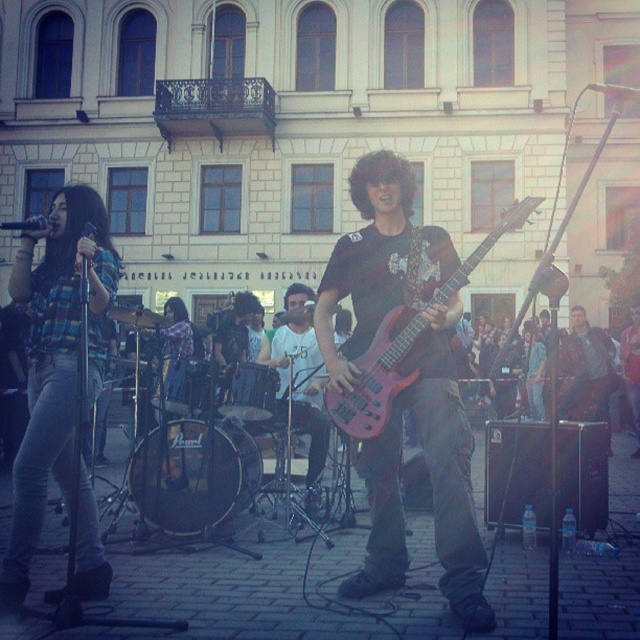
Is plaid fabric shirt at left further to the viewer compared to shiny red electric guitar at center?

No, plaid fabric shirt at left is in front of shiny red electric guitar at center.

Is point (97, 324) positioned after point (365, 352)?

That is True.

Between point (40, 392) and point (385, 339), which one is positioned in front?

Point (40, 392) is more forward.

This screenshot has height=640, width=640. Find the location of `plaid fabric shirt at left`. plaid fabric shirt at left is located at coordinates (54, 362).

Which is more to the right, plaid fabric shirt at left or metallic silver microphone at upper right?

Positioned to the right is metallic silver microphone at upper right.

Can you confirm if plaid fabric shirt at left is positioned above metallic silver microphone at upper right?

Incorrect, plaid fabric shirt at left is not positioned above metallic silver microphone at upper right.

Measure the distance between point (28, 442) and camera.

24.64 feet

At what (x,y) coordinates should I click in order to perform the action: click on plaid fabric shirt at left. Please return your answer as a coordinate pair (x, y). Looking at the image, I should click on (54, 362).

Between point (387, 166) and point (522, 211), which one is positioned in front?

Point (522, 211)

How far apart are matte black guitar at center and shiny red electric guitar at center?

matte black guitar at center is 2.03 meters away from shiny red electric guitar at center.

Image resolution: width=640 pixels, height=640 pixels. I want to click on matte black guitar at center, so click(406, 387).